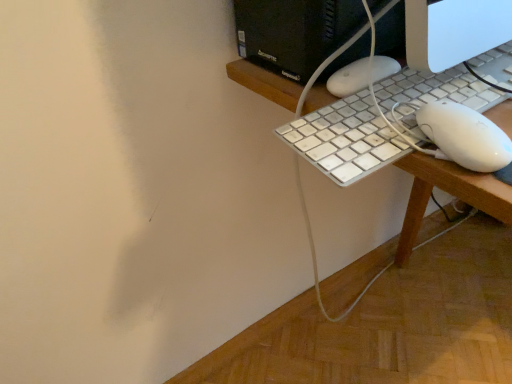
What do you see at coordinates (449, 193) in the screenshot?
I see `white plastic keyboard at center` at bounding box center [449, 193].

Find the location of a particular element. This screenshot has height=384, width=512. white plastic keyboard at center is located at coordinates (449, 193).

This screenshot has height=384, width=512. Describe the element at coordinates (345, 139) in the screenshot. I see `white plastic keyboard at right` at that location.

This screenshot has height=384, width=512. I want to click on white plastic keyboard at right, so click(345, 139).

Where is `white plastic keyboard at center`? Image resolution: width=512 pixels, height=384 pixels. white plastic keyboard at center is located at coordinates (449, 193).

Based on the photo, between white plastic keyboard at right and white plastic keyboard at center, which one appears on the left side from the viewer's perspective?

Positioned to the left is white plastic keyboard at right.

Which object is closer to the camera taking this photo, white plastic keyboard at right or white plastic keyboard at center?

white plastic keyboard at center is more forward.

Does point (309, 128) appear closer or farther from the camera than point (409, 252)?

Point (309, 128) is closer to the camera than point (409, 252).

From the image's perspective, is white plastic keyboard at right located above or below white plastic keyboard at center?

white plastic keyboard at right is above white plastic keyboard at center.

From the picture: From a real-world perspective, is white plastic keyboard at right on white plastic keyboard at center?

Correct, in the physical world, white plastic keyboard at right is higher than white plastic keyboard at center.

Considering the sizes of objects white plastic keyboard at right and white plastic keyboard at center in the image provided, who is wider, white plastic keyboard at right or white plastic keyboard at center?

Wider between the two is white plastic keyboard at center.

Considering the relative sizes of white plastic keyboard at right and white plastic keyboard at center in the image provided, is white plastic keyboard at right taller than white plastic keyboard at center?

Incorrect, the height of white plastic keyboard at right is not larger of that of white plastic keyboard at center.

Which of these two, white plastic keyboard at right or white plastic keyboard at center, is bigger?

Bigger between the two is white plastic keyboard at center.

Is white plastic keyboard at right outside of white plastic keyboard at center?

Yes.

Is white plastic keyboard at right far from white plastic keyboard at center?

No, white plastic keyboard at right is not far from white plastic keyboard at center.

Is white plastic keyboard at right looking in the opposite direction of white plastic keyboard at center?

No, white plastic keyboard at right is not facing the opposite direction of white plastic keyboard at center.

How different are the orientations of white plastic keyboard at right and white plastic keyboard at center in degrees?

18 degrees separate the facing orientations of white plastic keyboard at right and white plastic keyboard at center.

Measure the distance between white plastic keyboard at right and white plastic keyboard at center.

white plastic keyboard at right is 2.53 inches from white plastic keyboard at center.

Where is `desk located on the right of white plastic keyboard at right`? Image resolution: width=512 pixels, height=384 pixels. desk located on the right of white plastic keyboard at right is located at coordinates (449, 193).

Which is more to the right, white plastic keyboard at center or white plastic keyboard at right?

Positioned to the right is white plastic keyboard at center.

Which object is further away from the camera taking this photo, white plastic keyboard at center or white plastic keyboard at right?

white plastic keyboard at right is behind.

Is point (285, 88) closer to viewer compared to point (385, 92)?

No, (285, 88) is further to viewer.

From the image's perspective, which is above, white plastic keyboard at center or white plastic keyboard at right?

white plastic keyboard at right, from the image's perspective.

Consider the image. From a real-world perspective, relative to white plastic keyboard at right, is white plastic keyboard at center vertically above or below?

white plastic keyboard at center is below white plastic keyboard at right.

Which of these two, white plastic keyboard at center or white plastic keyboard at right, is wider?

white plastic keyboard at center.

From the picture: Considering the relative sizes of white plastic keyboard at center and white plastic keyboard at right in the image provided, is white plastic keyboard at center taller than white plastic keyboard at right?

Yes.

Between white plastic keyboard at center and white plastic keyboard at right, which one has larger size?

white plastic keyboard at center.

Is white plastic keyboard at right surrounded by white plastic keyboard at center?

That's incorrect, white plastic keyboard at right is not inside white plastic keyboard at center.

Is white plastic keyboard at center in contact with white plastic keyboard at right?

Yes, white plastic keyboard at center is touching white plastic keyboard at right.

Is white plastic keyboard at center aimed at white plastic keyboard at right?

No.

Where is `computer keyboard that appears behind the white plastic keyboard at center`? The width and height of the screenshot is (512, 384). computer keyboard that appears behind the white plastic keyboard at center is located at coordinates (345, 139).

At what (x,y) coordinates should I click in order to perform the action: click on desk below the white plastic keyboard at right (from a real-world perspective). Please return your answer as a coordinate pair (x, y). The height and width of the screenshot is (384, 512). Looking at the image, I should click on (449, 193).

Locate an element on the screen. This screenshot has height=384, width=512. computer keyboard behind the white plastic keyboard at center is located at coordinates (345, 139).